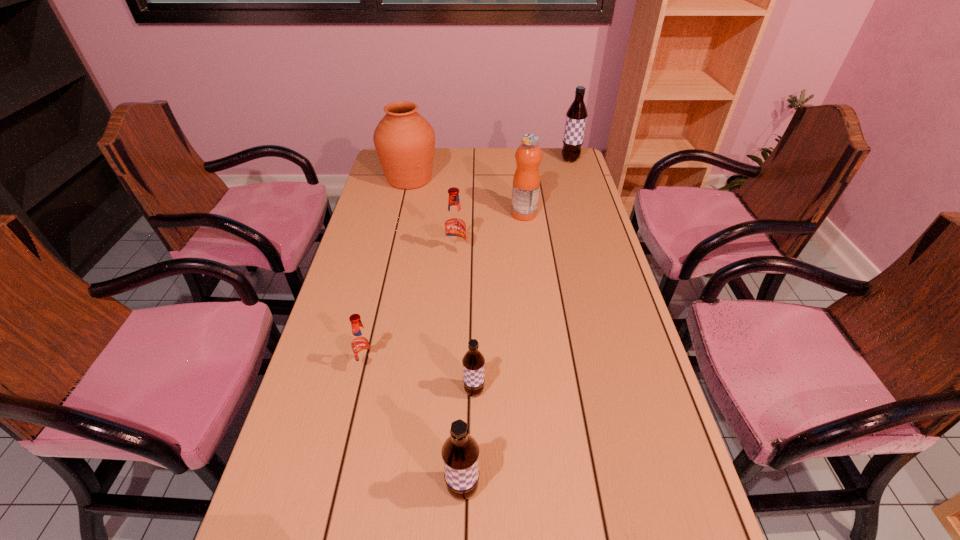
In the image, there is a desktop. Identify the location of free space at the right edge. Image resolution: width=960 pixels, height=540 pixels. (590, 387).

The image size is (960, 540). I want to click on free space between the leftmost root beer and the nearest root beer, so click(416, 427).

Identify the location of unoccupied area between the tallest root beer and the nearest root beer. The image size is (960, 540). (516, 324).

This screenshot has height=540, width=960. I want to click on unoccupied position between the nearest root beer and the urn, so click(436, 334).

In order to click on free space between the third farthest root beer and the right red root beer in this screenshot , I will do `click(412, 310)`.

Find the location of a particular element. The image size is (960, 540). vacant area that lies between the farthest root beer and the nearest brown root beer is located at coordinates (516, 324).

You are a GUI agent. You are given a task and a screenshot of the screen. Output one action in this format:
    pyautogui.click(x=<x>, y=<y>)
    Task: Click on the free spot between the nearest object and the brown urn
    The width and height of the screenshot is (960, 540).
    Given the screenshot: What is the action you would take?
    pyautogui.click(x=436, y=334)

Image resolution: width=960 pixels, height=540 pixels. I want to click on free area in between the left red root beer and the bigger red root beer, so click(412, 310).

This screenshot has height=540, width=960. Identify the location of object that ranks as the fourth closest to the sixth nearest object. (362, 345).

Where is `object that is the fourth closest one to the right red root beer`? object that is the fourth closest one to the right red root beer is located at coordinates (473, 361).